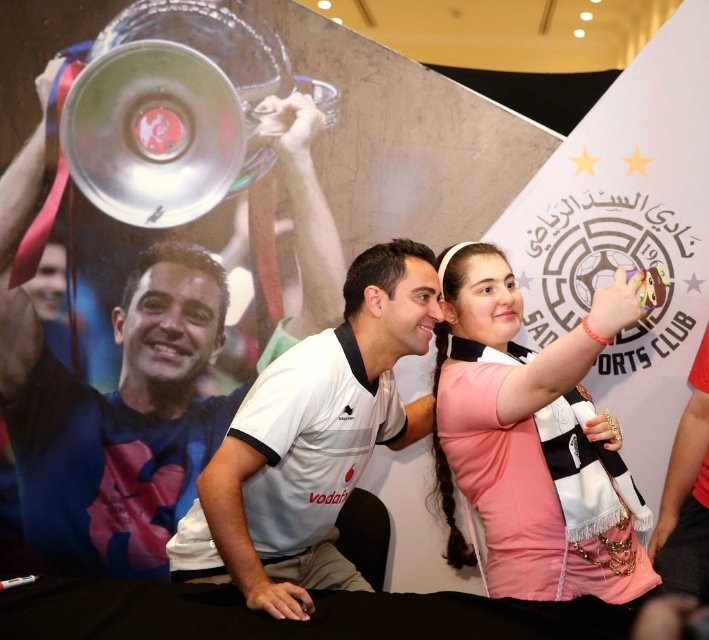
Can you confirm if pink fabric scarf at center is positioned above white matte shirt at center?

A: Actually, pink fabric scarf at center is below white matte shirt at center.

The image size is (709, 640). In order to click on pink fabric scarf at center in this screenshot , I will do `click(530, 442)`.

Locate an element on the screen. The height and width of the screenshot is (640, 709). pink fabric scarf at center is located at coordinates (530, 442).

Locate an element on the screen. The image size is (709, 640). pink fabric scarf at center is located at coordinates (530, 442).

Image resolution: width=709 pixels, height=640 pixels. What do you see at coordinates (111, 403) in the screenshot? I see `metallic trophy at upper left` at bounding box center [111, 403].

Does metallic trophy at upper left have a smaller size compared to pink fabric scarf at center?

Yes, metallic trophy at upper left is smaller than pink fabric scarf at center.

What do you see at coordinates (111, 403) in the screenshot?
I see `metallic trophy at upper left` at bounding box center [111, 403].

Where is `metallic trophy at upper left`? The image size is (709, 640). metallic trophy at upper left is located at coordinates (111, 403).

Who is taller, metallic trophy at upper left or white matte shirt at center?

Standing taller between the two is metallic trophy at upper left.

Does metallic trophy at upper left appear over white matte shirt at center?

Yes, metallic trophy at upper left is above white matte shirt at center.

Does point (194, 397) lie behind point (267, 484)?

Yes.

Identify the location of metallic trophy at upper left. This screenshot has width=709, height=640. (111, 403).